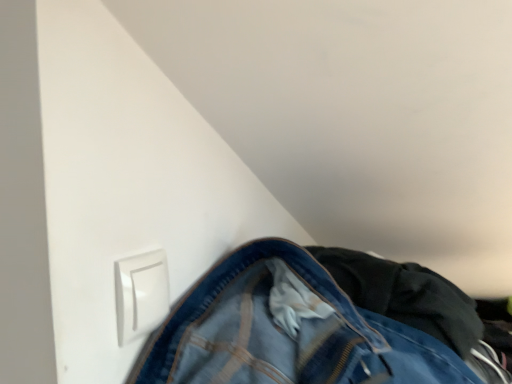
At what (x,y) coordinates should I click in order to perform the action: click on denim at lower right. Please return your answer as a coordinate pair (x, y). Looking at the image, I should click on (286, 333).

The width and height of the screenshot is (512, 384). What do you see at coordinates (286, 333) in the screenshot?
I see `denim at lower right` at bounding box center [286, 333].

Image resolution: width=512 pixels, height=384 pixels. Describe the element at coordinates (140, 294) in the screenshot. I see `white plastic switch at lower left` at that location.

Identify the location of white plastic switch at lower left. (140, 294).

Where is `denim at lower right`? denim at lower right is located at coordinates (286, 333).

Is denim at lower right to the right of white plastic switch at lower left from the viewer's perspective?

Yes, denim at lower right is to the right of white plastic switch at lower left.

Does denim at lower right come behind white plastic switch at lower left?

Yes, denim at lower right is behind white plastic switch at lower left.

Between point (270, 307) and point (127, 262), which one is positioned behind?

The point (270, 307) is farther.

From the image's perspective, which one is positioned lower, denim at lower right or white plastic switch at lower left?

denim at lower right, from the image's perspective.

Based on the photo, from a real-world perspective, between denim at lower right and white plastic switch at lower left, who is vertically higher?

white plastic switch at lower left.

Does denim at lower right have a lesser width compared to white plastic switch at lower left?

In fact, denim at lower right might be wider than white plastic switch at lower left.

Between denim at lower right and white plastic switch at lower left, which one has more height?

denim at lower right.

Consider the image. Looking at the image, does denim at lower right seem bigger or smaller compared to white plastic switch at lower left?

In the image, denim at lower right appears to be larger than white plastic switch at lower left.

Is denim at lower right spatially inside white plastic switch at lower left, or outside of it?

denim at lower right is spatially situated outside white plastic switch at lower left.

Is the surface of denim at lower right in direct contact with white plastic switch at lower left?

No, denim at lower right is not with white plastic switch at lower left.

Is denim at lower right oriented towards white plastic switch at lower left?

No, denim at lower right is not turned towards white plastic switch at lower left.

Find the location of a particular element. The image size is (512, 384). electric outlet in front of the denim at lower right is located at coordinates (140, 294).

Between white plastic switch at lower left and denim at lower right, which one appears on the right side from the viewer's perspective?

denim at lower right.

Considering the positions of objects white plastic switch at lower left and denim at lower right in the image provided, who is in front, white plastic switch at lower left or denim at lower right?

Positioned in front is white plastic switch at lower left.

Is point (150, 292) positioned in front of point (258, 322)?

Yes, it is in front of point (258, 322).

From the image's perspective, is white plastic switch at lower left positioned above or below denim at lower right?

From the image's perspective, white plastic switch at lower left appears above denim at lower right.

Consider the image. From a real-world perspective, is white plastic switch at lower left positioned under denim at lower right based on gravity?

No, from a real-world perspective, white plastic switch at lower left is not beneath denim at lower right.

Considering the sizes of white plastic switch at lower left and denim at lower right in the image, is white plastic switch at lower left wider or thinner than denim at lower right?

In the image, white plastic switch at lower left appears to be more narrow than denim at lower right.

Between white plastic switch at lower left and denim at lower right, which one has more height?

denim at lower right is taller.

Who is bigger, white plastic switch at lower left or denim at lower right?

With larger size is denim at lower right.

Is denim at lower right located within white plastic switch at lower left?

No, denim at lower right is located outside of white plastic switch at lower left.

Is white plastic switch at lower left far from denim at lower right?

That's not correct — white plastic switch at lower left is a little close to denim at lower right.

Based on the photo, is white plastic switch at lower left aimed at denim at lower right?

No, white plastic switch at lower left is not turned towards denim at lower right.

How many degrees apart are the facing directions of white plastic switch at lower left and denim at lower right?

white plastic switch at lower left and denim at lower right are facing 4.61 degrees away from each other.

Measure the distance between white plastic switch at lower left and denim at lower right.

7.48 inches.

Where is `trousers below the white plastic switch at lower left (from the image's perspective)`? The height and width of the screenshot is (384, 512). trousers below the white plastic switch at lower left (from the image's perspective) is located at coordinates (286, 333).

What are the coordinates of `electric outlet on the left of denim at lower right` in the screenshot? It's located at (140, 294).

The height and width of the screenshot is (384, 512). I want to click on electric outlet in front of the denim at lower right, so click(140, 294).